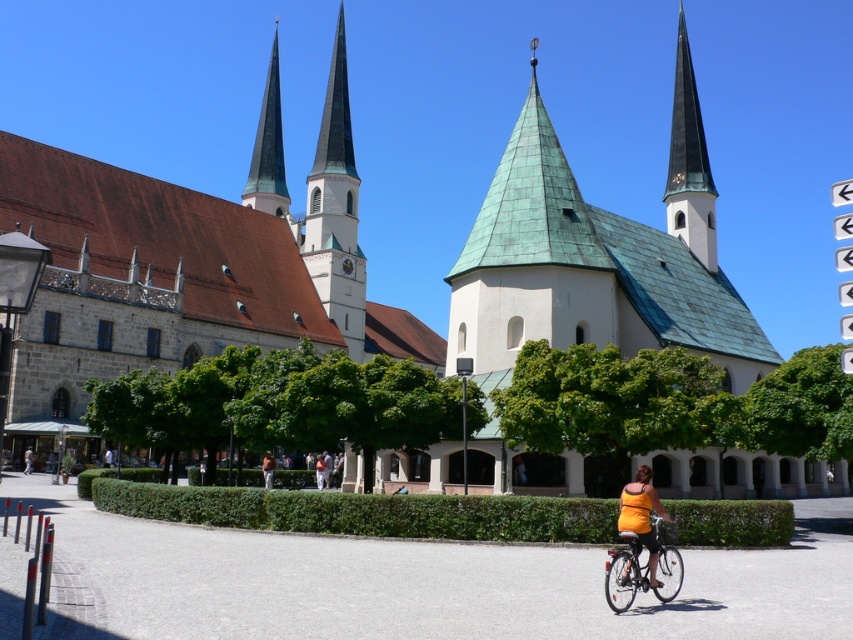
Can you confirm if green copper spire at center is positioned to the left of orange fabric shirt at lower right?

Yes, green copper spire at center is to the left of orange fabric shirt at lower right.

In the scene shown: Is green copper spire at center to the right of orange fabric shirt at lower right from the viewer's perspective?

No, green copper spire at center is not to the right of orange fabric shirt at lower right.

Locate an element on the screen. The image size is (853, 640). green copper spire at center is located at coordinates (335, 209).

Is smooth gray spire at center left in front of orange fabric shirt at center?

No, smooth gray spire at center left is further to the viewer.

Can you confirm if smooth gray spire at center left is shorter than orange fabric shirt at center?

Incorrect, smooth gray spire at center left's height does not fall short of orange fabric shirt at center's.

The image size is (853, 640). I want to click on smooth gray spire at center left, so 268,148.

Is green copper spire at center taller than orange t-shirt at lower center?

Yes, green copper spire at center is taller than orange t-shirt at lower center.

Which is more to the left, green copper spire at center or orange t-shirt at lower center?

From the viewer's perspective, orange t-shirt at lower center appears more on the left side.

You are a GUI agent. You are given a task and a screenshot of the screen. Output one action in this format:
    pyautogui.click(x=<x>, y=<y>)
    Task: Click on the green copper spire at center
    The image size is (853, 640).
    Given the screenshot: What is the action you would take?
    pyautogui.click(x=335, y=209)

The width and height of the screenshot is (853, 640). What are the coordinates of `green copper spire at center` in the screenshot? It's located at (335, 209).